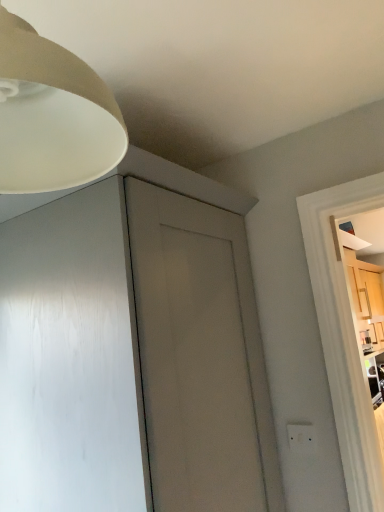
Locate an element on the screen. The image size is (384, 512). matte white lampshade at upper left is located at coordinates (52, 115).

Describe the element at coordinates (52, 115) in the screenshot. I see `matte white lampshade at upper left` at that location.

The width and height of the screenshot is (384, 512). Describe the element at coordinates (301, 438) in the screenshot. I see `white plastic electric outlet at lower right` at that location.

The image size is (384, 512). Find the location of `white plastic electric outlet at lower right`. white plastic electric outlet at lower right is located at coordinates (301, 438).

Locate an element on the screen. This screenshot has width=384, height=512. matte white lampshade at upper left is located at coordinates (52, 115).

Does matte white lampshade at upper left appear on the right side of white plastic electric outlet at lower right?

No, matte white lampshade at upper left is not to the right of white plastic electric outlet at lower right.

Considering the positions of objects matte white lampshade at upper left and white plastic electric outlet at lower right in the image provided, who is in front, matte white lampshade at upper left or white plastic electric outlet at lower right?

matte white lampshade at upper left is more forward.

Between point (60, 128) and point (301, 449), which one is positioned behind?

The point (301, 449) is more distant.

From the image's perspective, which object appears higher, matte white lampshade at upper left or white plastic electric outlet at lower right?

matte white lampshade at upper left, from the image's perspective.

From a real-world perspective, which is physically above, matte white lampshade at upper left or white plastic electric outlet at lower right?

matte white lampshade at upper left, from a real-world perspective.

Which object is thinner, matte white lampshade at upper left or white plastic electric outlet at lower right?

Thinner between the two is white plastic electric outlet at lower right.

Considering the sizes of matte white lampshade at upper left and white plastic electric outlet at lower right in the image, is matte white lampshade at upper left taller or shorter than white plastic electric outlet at lower right?

matte white lampshade at upper left is taller than white plastic electric outlet at lower right.

Which of these two, matte white lampshade at upper left or white plastic electric outlet at lower right, is smaller?

white plastic electric outlet at lower right.

Is matte white lampshade at upper left not within white plastic electric outlet at lower right?

Yes, matte white lampshade at upper left is located beyond the bounds of white plastic electric outlet at lower right.

In the scene shown: Is there a large distance between matte white lampshade at upper left and white plastic electric outlet at lower right?

matte white lampshade at upper left is positioned a significant distance from white plastic electric outlet at lower right.

Is matte white lampshade at upper left aimed at white plastic electric outlet at lower right?

No, matte white lampshade at upper left is not turned towards white plastic electric outlet at lower right.

What's the angular difference between matte white lampshade at upper left and white plastic electric outlet at lower right's facing directions?

177 degrees.

Measure the distance between matte white lampshade at upper left and white plastic electric outlet at lower right.

matte white lampshade at upper left and white plastic electric outlet at lower right are 1.15 meters apart.

Find the location of `electric outlet below the matte white lampshade at upper left (from the image's perspective)`. electric outlet below the matte white lampshade at upper left (from the image's perspective) is located at coordinates (301, 438).

Does white plastic electric outlet at lower right appear on the left side of matte white lampshade at upper left?

No, white plastic electric outlet at lower right is not to the left of matte white lampshade at upper left.

Between white plastic electric outlet at lower right and matte white lampshade at upper left, which one is positioned in front?

Positioned in front is matte white lampshade at upper left.

Between point (315, 448) and point (56, 89), which one is positioned in front?

The point (56, 89) is more forward.

From the image's perspective, relative to matte white lampshade at upper left, is white plastic electric outlet at lower right above or below?

From the image's perspective, white plastic electric outlet at lower right appears below matte white lampshade at upper left.

From a real-world perspective, is white plastic electric outlet at lower right over matte white lampshade at upper left?

Actually, white plastic electric outlet at lower right is physically below matte white lampshade at upper left in the real world.

Consider the image. Considering the sizes of white plastic electric outlet at lower right and matte white lampshade at upper left in the image, is white plastic electric outlet at lower right wider or thinner than matte white lampshade at upper left?

In the image, white plastic electric outlet at lower right appears to be more narrow than matte white lampshade at upper left.

Who is taller, white plastic electric outlet at lower right or matte white lampshade at upper left?

With more height is matte white lampshade at upper left.

In terms of size, does white plastic electric outlet at lower right appear bigger or smaller than matte white lampshade at upper left?

Considering their sizes, white plastic electric outlet at lower right takes up less space than matte white lampshade at upper left.

Can we say white plastic electric outlet at lower right lies outside matte white lampshade at upper left?

That's correct, white plastic electric outlet at lower right is outside of matte white lampshade at upper left.

Are white plastic electric outlet at lower right and matte white lampshade at upper left located far from each other?

Indeed, white plastic electric outlet at lower right is not near matte white lampshade at upper left.

Is white plastic electric outlet at lower right facing towards matte white lampshade at upper left?

No, white plastic electric outlet at lower right is not aimed at matte white lampshade at upper left.

How many degrees apart are the facing directions of white plastic electric outlet at lower right and matte white lampshade at upper left?

They differ by 177 degrees in their facing directions.

Looking at this image, how much distance is there between white plastic electric outlet at lower right and matte white lampshade at upper left?

white plastic electric outlet at lower right is 1.15 meters from matte white lampshade at upper left.

At what (x,y) coordinates should I click in order to perform the action: click on lamp above the white plastic electric outlet at lower right (from the image's perspective). Please return your answer as a coordinate pair (x, y). Looking at the image, I should click on (52, 115).

Find the location of `electric outlet below the matte white lampshade at upper left (from a real-world perspective)`. electric outlet below the matte white lampshade at upper left (from a real-world perspective) is located at coordinates (301, 438).

Where is `lamp above the white plastic electric outlet at lower right (from a real-world perspective)`? lamp above the white plastic electric outlet at lower right (from a real-world perspective) is located at coordinates (52, 115).